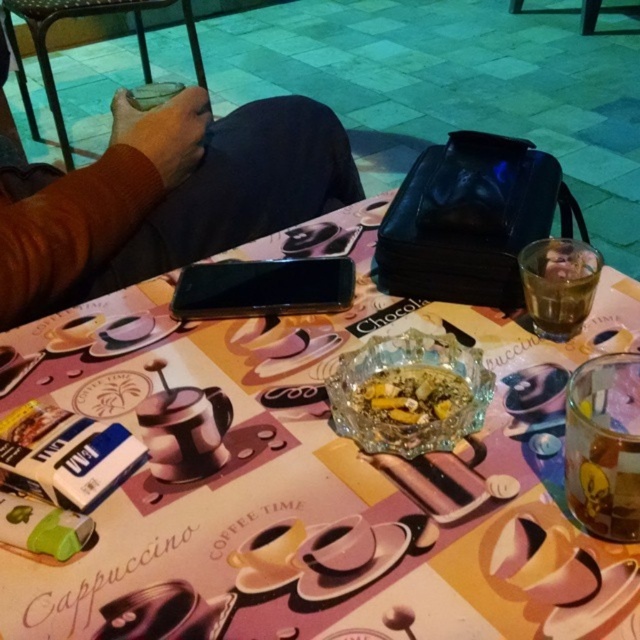
Question: Does brown leather jacket at upper left have a smaller size compared to translucent glass at upper right?

Choices:
 (A) no
 (B) yes

Answer: (A)

Question: Can you confirm if matte plastic phone at upper center is positioned to the right of translucent glass bowl at center?

Choices:
 (A) no
 (B) yes

Answer: (A)

Question: Does brown leather jacket at upper left have a larger size compared to matte plastic phone at upper center?

Choices:
 (A) yes
 (B) no

Answer: (B)

Question: Which object appears farthest from the camera in this image?

Choices:
 (A) transparent glass ashtray at center
 (B) translucent glass cup at lower right
 (C) matte plastic phone at upper center

Answer: (C)

Question: Considering the real-world distances, which object is closest to the translucent glass at upper right?

Choices:
 (A) transparent glass ashtray at center
 (B) translucent glass cup at lower right
 (C) brown leather jacket at upper left

Answer: (B)

Question: Which point appears closest to the camera in this image?

Choices:
 (A) (392, 412)
 (B) (196, 83)
 (C) (240, 120)

Answer: (A)